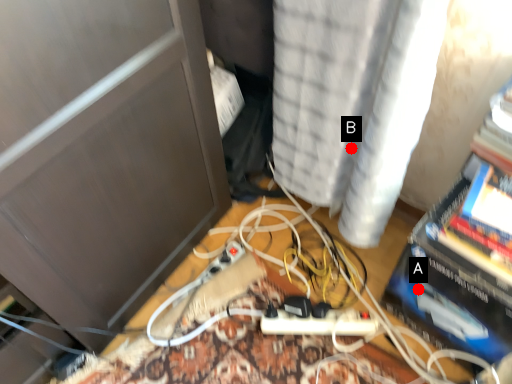
Question: Two points are circled on the image, labeled by A and B beside each circle. Which of the following is the farthest from the observer?

Choices:
 (A) A is further
 (B) B is further

Answer: (B)